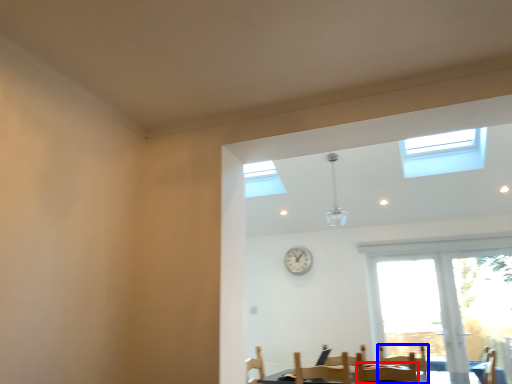
Question: Which point is further to the camera, chair (highlighted by a red box) or armchair (highlighted by a blue box)?

Choices:
 (A) chair
 (B) armchair

Answer: (B)